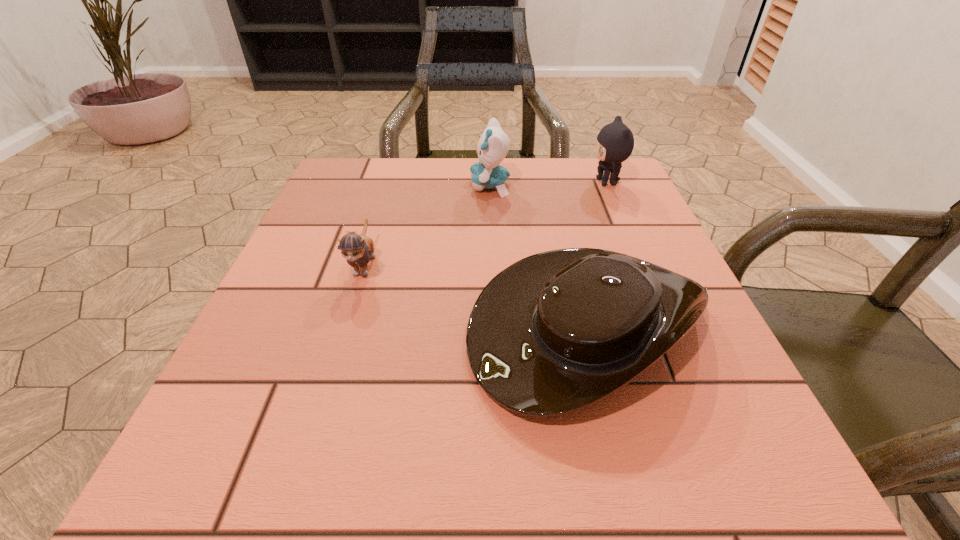
You are a GUI agent. You are given a task and a screenshot of the screen. Output one action in this format:
    pyautogui.click(x=<x>, y=<y>)
    Task: Click on the vacant region at the right edge of the desktop
    This screenshot has height=540, width=960.
    Given the screenshot: What is the action you would take?
    pyautogui.click(x=637, y=214)

Identify the location of free region at the far left corner. (372, 175).

Identify the location of free space at the near left corner of the desktop. Image resolution: width=960 pixels, height=540 pixels. (221, 448).

This screenshot has height=540, width=960. In order to click on free space at the far right corner of the desktop in this screenshot , I will do `click(629, 208)`.

Identify the location of vacant space at the near right corner of the desktop. This screenshot has height=540, width=960. (729, 441).

Where is `unoccupied area between the second kitten from left to right and the leftmost object`? This screenshot has height=540, width=960. unoccupied area between the second kitten from left to right and the leftmost object is located at coordinates (427, 225).

Image resolution: width=960 pixels, height=540 pixels. I want to click on free space between the leftmost object and the cowboy hat, so click(x=475, y=294).

What are the coordinates of `free spot between the leftmost object and the second kitten from right to left` in the screenshot? It's located at (427, 225).

Where is `vacant space that's between the shortest kitten and the second kitten from left to right`? vacant space that's between the shortest kitten and the second kitten from left to right is located at coordinates pos(427,225).

The width and height of the screenshot is (960, 540). I want to click on blank region between the rightmost kitten and the leftmost kitten, so click(486, 223).